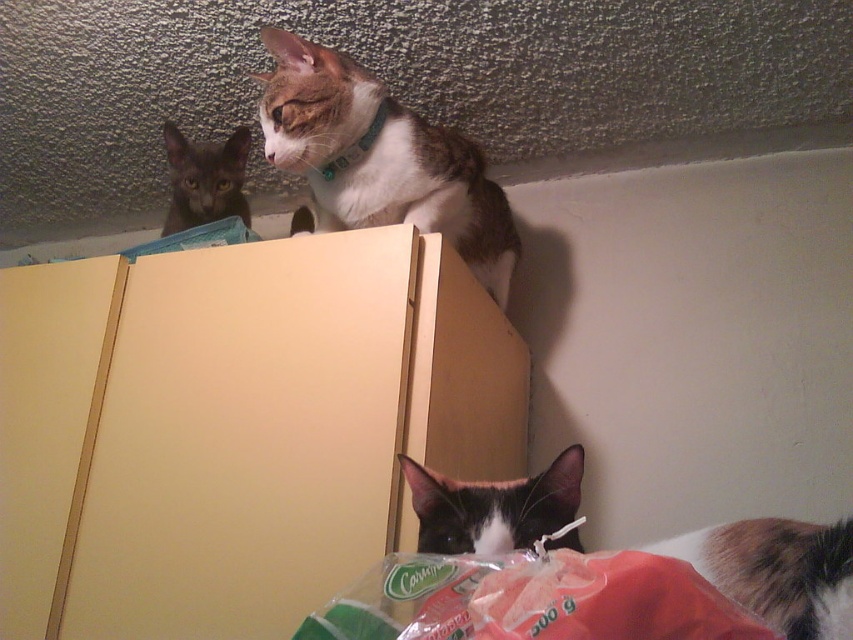
Question: Which is farther from the brown and white fur at upper center?

Choices:
 (A) black fur cat at lower center
 (B) black and white fur cat at lower right
 (C) dark gray fur at upper left

Answer: (B)

Question: Can you confirm if black fur cat at lower center is wider than dark gray fur at upper left?

Choices:
 (A) yes
 (B) no

Answer: (B)

Question: Which point is farther to the camera?

Choices:
 (A) black fur cat at lower center
 (B) black and white fur cat at lower right
 (C) brown and white fur at upper center

Answer: (C)

Question: Based on their relative distances, which object is nearer to the dark gray fur at upper left?

Choices:
 (A) black fur cat at lower center
 (B) black and white fur cat at lower right
 (C) brown and white fur at upper center

Answer: (C)

Question: Does black and white fur cat at lower right have a greater width compared to dark gray fur at upper left?

Choices:
 (A) no
 (B) yes

Answer: (B)

Question: Considering the relative positions of brown and white fur at upper center and black and white fur cat at lower right in the image provided, where is brown and white fur at upper center located with respect to black and white fur cat at lower right?

Choices:
 (A) below
 (B) above

Answer: (B)